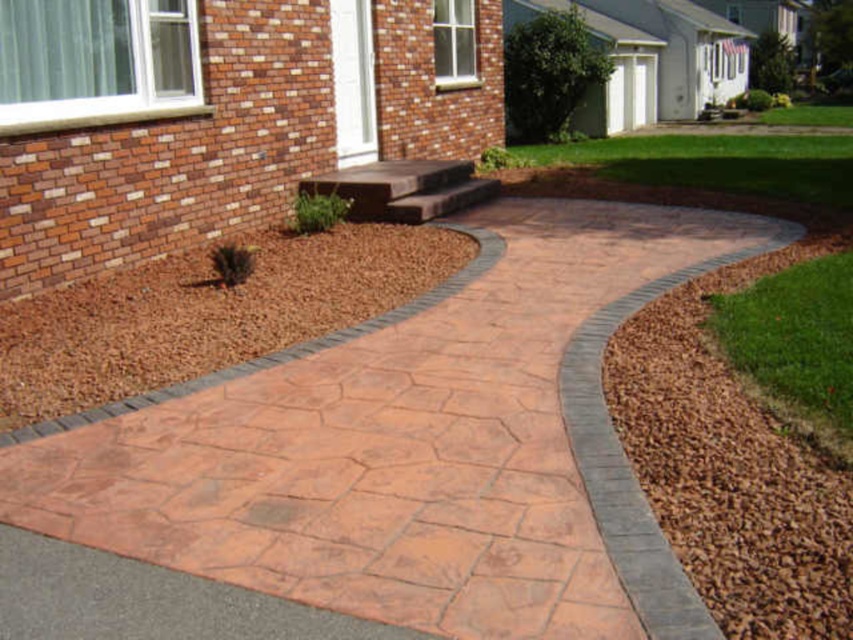
You are standing at the driveway and want to walk to the front door of the brick house. The path you need to take is bordered by the terracotta concrete path at center and the green grass at lower right. Which of these two areas is closer to you as you start walking towards the house?

The terracotta concrete path at center is closer to the viewer than the green grass at lower right, so the terracotta concrete path at center is closer to you as you start walking towards the house.

You are standing at the driveway and want to walk to the house. You see the brown gravel at lower right and the brown mulch at lower left. Which material will you step on first?

The brown gravel at lower right is in front of brown mulch at lower left, so you will step on the brown gravel at lower right first.